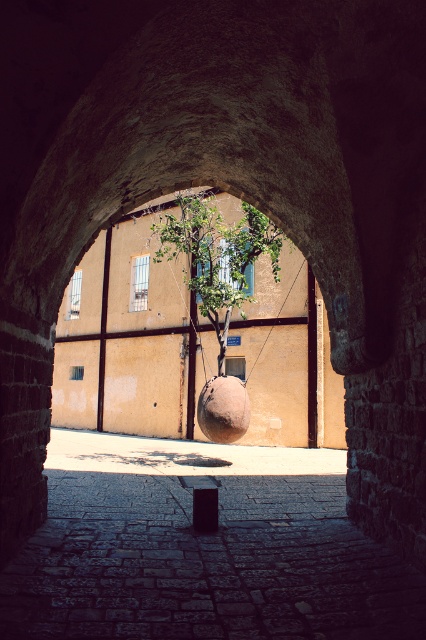
Which is more to the right, smooth stone alley at center or green leafy tree at center?

green leafy tree at center is more to the right.

Does point (192, 612) lie behind point (238, 300)?

That is False.

At what (x,y) coordinates should I click in order to perform the action: click on smooth stone alley at center. Please return your answer as a coordinate pair (x, y). This screenshot has height=640, width=426. Looking at the image, I should click on (201, 548).